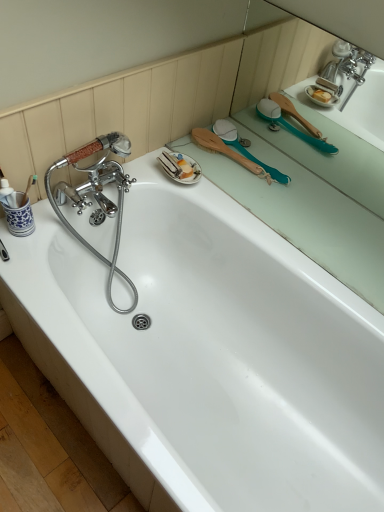
This screenshot has width=384, height=512. Describe the element at coordinates (279, 60) in the screenshot. I see `green rubber brush at upper right, the 2th mirror from the bottom` at that location.

At what (x,y) coordinates should I click in order to perform the action: click on teal rubber brush at upper right, the first mirror ordered from the bottom. Please return your answer as a coordinate pair (x, y). Looking at the image, I should click on (306, 166).

This screenshot has height=512, width=384. What do you see at coordinates (207, 355) in the screenshot? I see `white glossy bathtub at upper center` at bounding box center [207, 355].

Find the location of a particular element. This screenshot has width=384, height=512. green rubber brush at upper right, the 1th mirror from the top is located at coordinates (279, 60).

From the image's perspective, is teal rubber brush at upper right, the first mirror ordered from the bottom, beneath wooden-brushed teal brush at upper right?

Yes, from the image's perspective, teal rubber brush at upper right, the first mirror ordered from the bottom, is below wooden-brushed teal brush at upper right.

Would you say teal rubber brush at upper right, the first mirror ordered from the bottom, is outside wooden-brushed teal brush at upper right?

That's correct, teal rubber brush at upper right, the first mirror ordered from the bottom, is outside of wooden-brushed teal brush at upper right.

Considering the relative sizes of teal rubber brush at upper right, the second mirror in the top-to-bottom sequence, and wooden-brushed teal brush at upper right in the image provided, is teal rubber brush at upper right, the second mirror in the top-to-bottom sequence, taller than wooden-brushed teal brush at upper right?

No.

Which object is thinner, teal rubber brush at upper right, the second mirror in the top-to-bottom sequence, or wooden-brushed teal brush at upper right?

teal rubber brush at upper right, the second mirror in the top-to-bottom sequence, is thinner.

Between white glossy bathtub at upper center and teal rubber brush at upper right, the second mirror in the top-to-bottom sequence, which one has larger width?

white glossy bathtub at upper center.

This screenshot has width=384, height=512. What are the coordinates of `bathtub that is in front of the teal rubber brush at upper right, the second mirror in the top-to-bottom sequence` in the screenshot? It's located at (207, 355).

How different are the orientations of white glossy bathtub at upper center and teal rubber brush at upper right, the first mirror ordered from the bottom, in degrees?

0.117 degrees separate the facing orientations of white glossy bathtub at upper center and teal rubber brush at upper right, the first mirror ordered from the bottom.

Considering the positions of point (261, 410) and point (370, 302), is point (261, 410) closer or farther from the camera than point (370, 302)?

Point (261, 410).

How much distance is there between white glossy bathtub at upper center and green rubber brush at upper right, the 1th mirror from the top?

white glossy bathtub at upper center is 27.06 inches from green rubber brush at upper right, the 1th mirror from the top.

This screenshot has width=384, height=512. Identify the location of mirror that is the 2nd object to the right of the white glossy bathtub at upper center, starting at the anchor. point(279,60).

Between white glossy bathtub at upper center and green rubber brush at upper right, the 1th mirror from the top, which one appears on the right side from the viewer's perspective?

green rubber brush at upper right, the 1th mirror from the top.

Which object is further away from the camera taking this photo, white glossy bathtub at upper center or green rubber brush at upper right, the 2th mirror from the bottom?

green rubber brush at upper right, the 2th mirror from the bottom, is behind.

From a real-world perspective, which is physically below, wooden-brushed teal brush at upper right or white glossy bathtub at upper center?

white glossy bathtub at upper center, from a real-world perspective.

Does wooden-brushed teal brush at upper right lie behind white glossy bathtub at upper center?

Yes, it is.

Between wooden-brushed teal brush at upper right and white glossy bathtub at upper center, which one appears on the left side from the viewer's perspective?

From the viewer's perspective, white glossy bathtub at upper center appears more on the left side.

From the image's perspective, is wooden-brushed teal brush at upper right below white glossy bathtub at upper center?

No.

Which object is more forward, white glossy bathtub at upper center or wooden-brushed teal brush at upper right?

white glossy bathtub at upper center is in front.

Which is less distant, (139, 368) or (209, 141)?

The point (139, 368) is more forward.

Based on the photo, how distant is white glossy bathtub at upper center from wooden-brushed teal brush at upper right?

A distance of 23.07 inches exists between white glossy bathtub at upper center and wooden-brushed teal brush at upper right.

From the picture: Is white glossy bathtub at upper center far away from wooden-brushed teal brush at upper right?

white glossy bathtub at upper center is near wooden-brushed teal brush at upper right, not far away.

Is green rubber brush at upper right, the 1th mirror from the top, taller than teal rubber brush at upper right, the second mirror in the top-to-bottom sequence?

Indeed, green rubber brush at upper right, the 1th mirror from the top, has a greater height compared to teal rubber brush at upper right, the second mirror in the top-to-bottom sequence.

Would you say green rubber brush at upper right, the 2th mirror from the bottom, is inside or outside teal rubber brush at upper right, the first mirror ordered from the bottom?

green rubber brush at upper right, the 2th mirror from the bottom, exists outside the volume of teal rubber brush at upper right, the first mirror ordered from the bottom.

Image resolution: width=384 pixels, height=512 pixels. Identify the location of mirror on the left of green rubber brush at upper right, the 2th mirror from the bottom. (306, 166).

I want to click on the 2nd mirror counting from the right of the white glossy bathtub at upper center, so click(x=279, y=60).

In the image, is green rubber brush at upper right, the 2th mirror from the bottom, positioned in front of or behind white glossy bathtub at upper center?

Visually, green rubber brush at upper right, the 2th mirror from the bottom, is located behind white glossy bathtub at upper center.

What's the angular difference between green rubber brush at upper right, the 2th mirror from the bottom, and white glossy bathtub at upper center's facing directions?

The angular difference between green rubber brush at upper right, the 2th mirror from the bottom, and white glossy bathtub at upper center is 0.785 degrees.

This screenshot has width=384, height=512. Find the location of `brush above the teal rubber brush at upper right, the second mirror in the top-to-bottom sequence (from the image's perspective)`. brush above the teal rubber brush at upper right, the second mirror in the top-to-bottom sequence (from the image's perspective) is located at coordinates (227, 152).

Find the location of `bathtub that is under the teal rubber brush at upper right, the second mirror in the top-to-bottom sequence (from a real-world perspective)`. bathtub that is under the teal rubber brush at upper right, the second mirror in the top-to-bottom sequence (from a real-world perspective) is located at coordinates (207, 355).

Considering their positions, is green rubber brush at upper right, the 2th mirror from the bottom, positioned further to teal rubber brush at upper right, the first mirror ordered from the bottom, than wooden-brushed teal brush at upper right?

Based on the image, wooden-brushed teal brush at upper right appears to be further to teal rubber brush at upper right, the first mirror ordered from the bottom.

Considering their positions, is wooden-brushed teal brush at upper right positioned closer to green rubber brush at upper right, the 2th mirror from the bottom, than teal rubber brush at upper right, the second mirror in the top-to-bottom sequence?

Based on the image, teal rubber brush at upper right, the second mirror in the top-to-bottom sequence, appears to be nearer to green rubber brush at upper right, the 2th mirror from the bottom.

Consider the image. Considering their positions, is teal rubber brush at upper right, the second mirror in the top-to-bottom sequence, positioned closer to green rubber brush at upper right, the 2th mirror from the bottom, than white glossy bathtub at upper center?

teal rubber brush at upper right, the second mirror in the top-to-bottom sequence, is closer to green rubber brush at upper right, the 2th mirror from the bottom.

From the image, which object appears to be nearer to wooden-brushed teal brush at upper right, white glossy bathtub at upper center or green rubber brush at upper right, the 2th mirror from the bottom?

green rubber brush at upper right, the 2th mirror from the bottom, is positioned closer to the anchor wooden-brushed teal brush at upper right.

Looking at the image, which one is located further to teal rubber brush at upper right, the second mirror in the top-to-bottom sequence, wooden-brushed teal brush at upper right or green rubber brush at upper right, the 1th mirror from the top?

wooden-brushed teal brush at upper right is further to teal rubber brush at upper right, the second mirror in the top-to-bottom sequence.

Estimate the real-world distances between objects in this image. Which object is further from green rubber brush at upper right, the 1th mirror from the top, wooden-brushed teal brush at upper right or white glossy bathtub at upper center?

The object further to green rubber brush at upper right, the 1th mirror from the top, is white glossy bathtub at upper center.

Looking at this image, based on their spatial positions, is white glossy bathtub at upper center or teal rubber brush at upper right, the first mirror ordered from the bottom, further from wooden-brushed teal brush at upper right?

white glossy bathtub at upper center.

Based on their spatial positions, is white glossy bathtub at upper center or wooden-brushed teal brush at upper right further from green rubber brush at upper right, the 2th mirror from the bottom?

white glossy bathtub at upper center.

The width and height of the screenshot is (384, 512). Identify the location of brush between green rubber brush at upper right, the 2th mirror from the bottom, and white glossy bathtub at upper center vertically. (227, 152).

The height and width of the screenshot is (512, 384). What are the coordinates of `mirror between green rubber brush at upper right, the 1th mirror from the top, and white glossy bathtub at upper center, in the vertical direction` in the screenshot? It's located at (306, 166).

This screenshot has height=512, width=384. Identify the location of mirror between green rubber brush at upper right, the 2th mirror from the bottom, and wooden-brushed teal brush at upper right, along the z-axis. (306, 166).